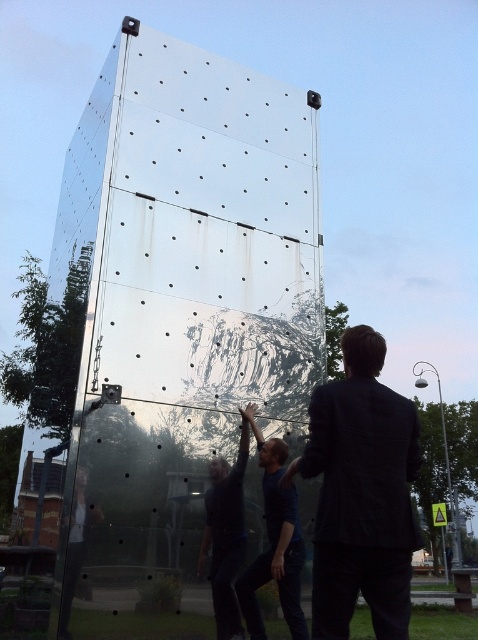
Which of these two, transparent glass at center or dark suit at center, stands taller?

With more height is transparent glass at center.

Between point (210, 259) and point (316, 572), which one is positioned behind?

The point (210, 259) is more distant.

Is point (97, 504) positioned after point (325, 444)?

That is True.

This screenshot has height=640, width=478. Find the location of `transparent glass at center`. transparent glass at center is located at coordinates (178, 330).

Does transparent glass at center have a lesser height compared to dark gray fabric shirt at center?

In fact, transparent glass at center may be taller than dark gray fabric shirt at center.

Is transparent glass at center above dark gray fabric shirt at center?

Indeed, transparent glass at center is positioned over dark gray fabric shirt at center.

Does point (204, 324) come behind point (219, 593)?

Yes, it is behind point (219, 593).

Where is `transparent glass at center`? Image resolution: width=478 pixels, height=640 pixels. transparent glass at center is located at coordinates (178, 330).

The height and width of the screenshot is (640, 478). In order to click on dark suit at center in this screenshot , I will do `click(360, 493)`.

Is dark suit at center thinner than dark gray fabric shirt at center?

In fact, dark suit at center might be wider than dark gray fabric shirt at center.

Describe the element at coordinates (360, 493) in the screenshot. The image size is (478, 640). I see `dark suit at center` at that location.

You are a GUI agent. You are given a task and a screenshot of the screen. Output one action in this format:
    pyautogui.click(x=<x>, y=<y>)
    Task: Click on the dark suit at center
    The image size is (478, 640).
    Given the screenshot: What is the action you would take?
    pyautogui.click(x=360, y=493)